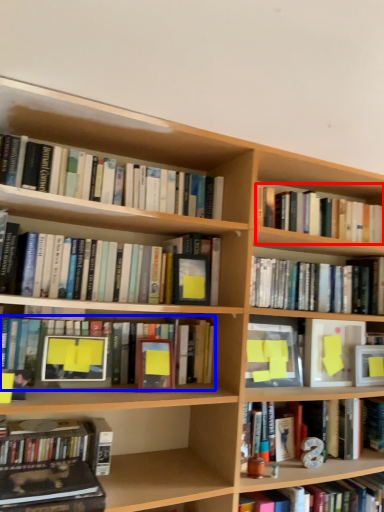
Question: Which object appears closest to the camera in this image, book (highlighted by a red box) or book (highlighted by a blue box)?

Choices:
 (A) book
 (B) book

Answer: (B)